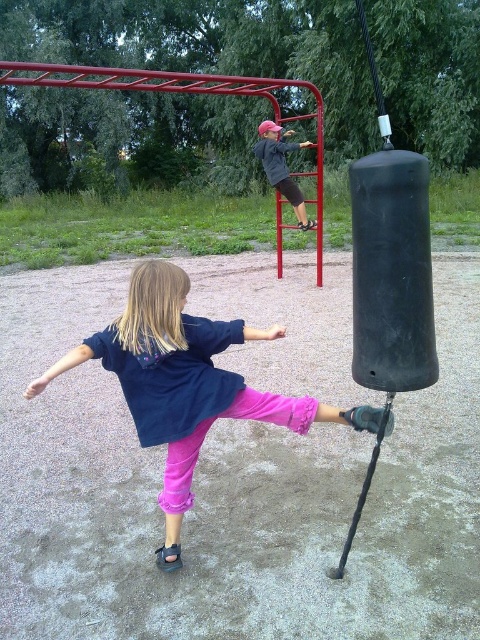
What are the coordinates of the pink fabric pants at lower center?

The pink fabric pants at lower center are located at coordinates point (189, 384).

Looking at this image, you are a photographer trying to capture a shot of the pink fabric pants at lower center and the matte black jacket at upper center. From your current position, which object is positioned to the left of the other?

The pink fabric pants at lower center are to the left of the matte black jacket at upper center.